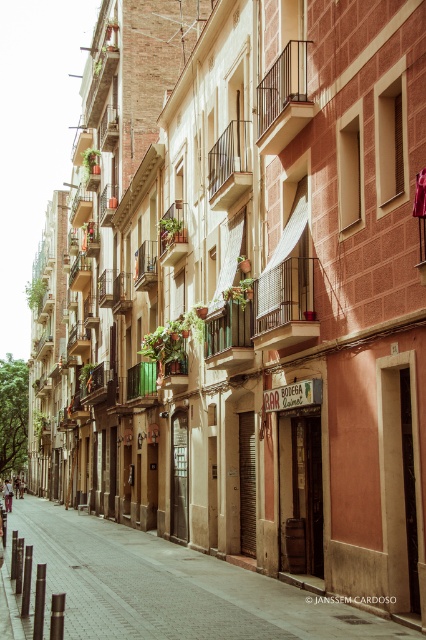
In the scene shown: You are a tourist standing on the street and want to take a photo of the metallic black balcony at upper center. To avoid stepping on the smooth brick pavement at center, where should you position yourself?

You should position yourself to the right of the smooth brick pavement at center since it is to the left of the metallic black balcony at upper center, so standing to its right would allow you to avoid stepping on it while photographing the balcony.

You are a tourist standing on the street and want to take a photo of both the metallic silver balcony at center and the green wooden balcony at center. Which balcony should you move to the left of to get both in your shot?

You should move to the left of the green wooden balcony at center because the metallic silver balcony at center is positioned to its right, so by standing left of the green wooden balcony at center, both balconies will be visible in your photo.

You are standing on a street in a European city and want to take a photo of two specific points marked in the image. The first point is at coordinates point (74, 548) and the second is at point (298, 131). Which point should you focus on first if you want to capture both points in a single frame without moving your camera?

You should focus on point (74, 548) first because it is closer to the camera than point (298, 131), allowing both points to be captured in the frame when adjusting the camera angle or zoom accordingly.